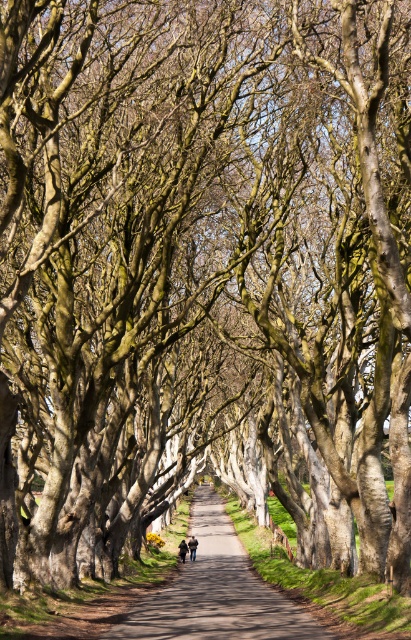
Is point (253, 600) positioned after point (191, 557)?

No, it is not.

Does smooth asphalt path at center have a lesser height compared to brown leather jacket at center?

In fact, smooth asphalt path at center may be taller than brown leather jacket at center.

Who is more forward, (149, 634) or (196, 545)?

Point (149, 634) is in front.

Locate an element on the screen. Image resolution: width=411 pixels, height=640 pixels. smooth asphalt path at center is located at coordinates (216, 592).

Is point (246, 561) closer to camera compared to point (180, 556)?

No, (246, 561) is further to viewer.

Is smooth asphalt path at center smaller than dark brown leather jacket at center?

Actually, smooth asphalt path at center might be larger than dark brown leather jacket at center.

Does point (205, 509) come farther from viewer compared to point (182, 552)?

Yes.

The height and width of the screenshot is (640, 411). Find the location of `smooth asphalt path at center`. smooth asphalt path at center is located at coordinates (216, 592).

Does brown leather jacket at center appear on the right side of dark brown leather jacket at center?

Indeed, brown leather jacket at center is positioned on the right side of dark brown leather jacket at center.

Between point (189, 541) and point (180, 560), which one is positioned in front?

Point (180, 560) is more forward.

The width and height of the screenshot is (411, 640). I want to click on brown leather jacket at center, so click(x=193, y=547).